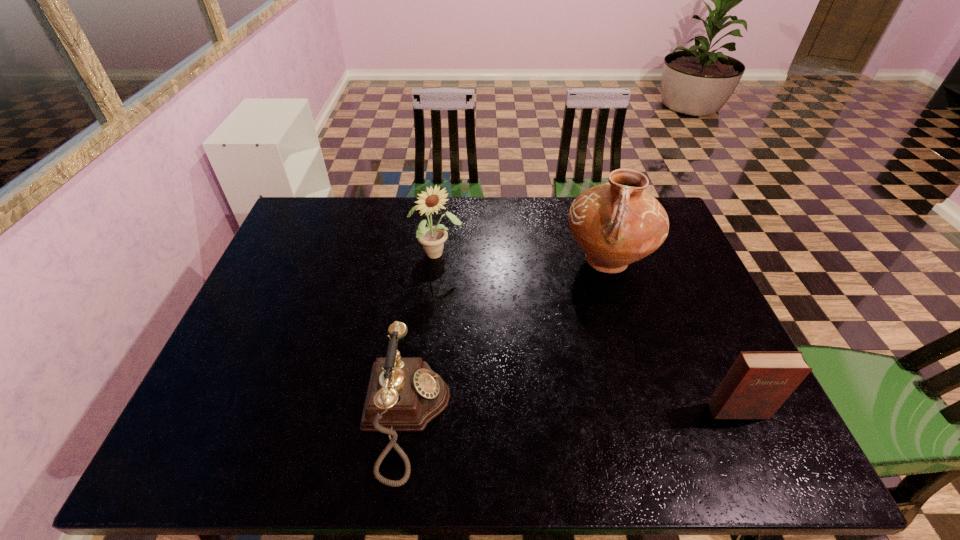
The height and width of the screenshot is (540, 960). I want to click on vacant space at the left edge of the desktop, so click(x=287, y=260).

Find the location of `vacant region at the right edge of the desktop`. vacant region at the right edge of the desktop is located at coordinates (682, 317).

Locate an element on the screen. free region at the far left corner is located at coordinates 317,237.

Identify the location of free space at the near right corner of the desktop. (687, 394).

Find the location of `empty space between the sunflower and the diary`. empty space between the sunflower and the diary is located at coordinates (587, 333).

This screenshot has height=540, width=960. Identify the location of free space between the diary and the telephone. pos(571,414).

The height and width of the screenshot is (540, 960). What are the coordinates of `unoccupied area between the telephone and the sunflower` in the screenshot? It's located at (421, 335).

Find the location of `unoccupied area between the pottery and the telephone`. unoccupied area between the pottery and the telephone is located at coordinates (506, 339).

Image resolution: width=960 pixels, height=540 pixels. In order to click on vacant point located between the telephone and the diary in this screenshot , I will do `click(571, 414)`.

In order to click on free space between the diary and the pottery in this screenshot , I will do `click(672, 336)`.